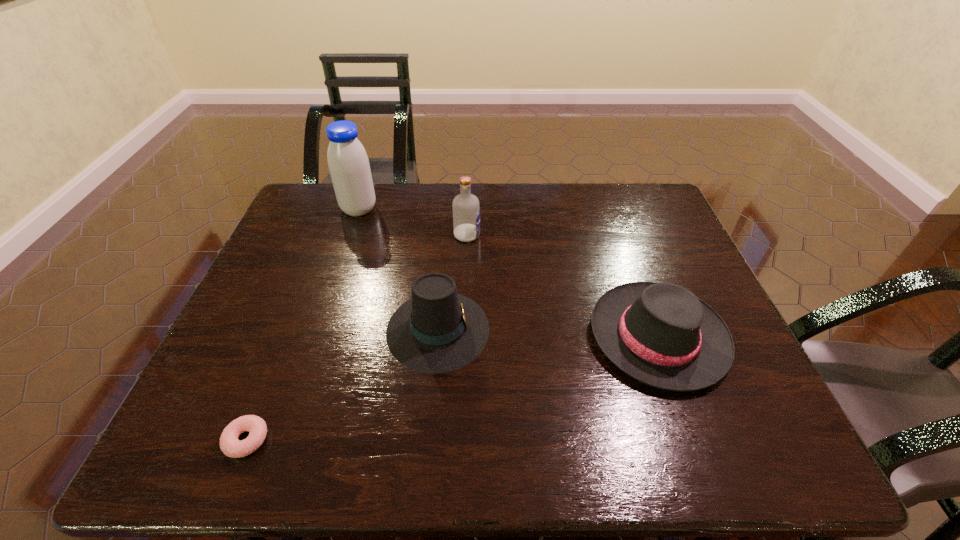
You are a GUI agent. You are given a task and a screenshot of the screen. Output one action in this format:
    pyautogui.click(x=<x>, y=<y>)
    Task: Click on the object at the far left corner
    The height and width of the screenshot is (540, 960).
    Given the screenshot: What is the action you would take?
    pyautogui.click(x=348, y=163)

The width and height of the screenshot is (960, 540). Find the location of `object at the near left corner`. object at the near left corner is located at coordinates (230, 445).

This screenshot has width=960, height=540. In the image, there is a desktop. What are the coordinates of `free space at the far edge` in the screenshot? It's located at (418, 215).

This screenshot has height=540, width=960. In the image, there is a desktop. Find the location of `vacant space at the near edge`. vacant space at the near edge is located at coordinates (605, 436).

The width and height of the screenshot is (960, 540). Identify the location of blank space at the left edge of the desktop. (283, 245).

Find the location of `free space at the right edge of the desktop`. free space at the right edge of the desktop is located at coordinates (678, 247).

At what (x,y) coordinates should I click in order to perform the action: click on vacant space at the far left corner. Please return your answer as a coordinate pair (x, y). This screenshot has width=960, height=540. Looking at the image, I should click on (308, 214).

Find the location of a particular element. The width and height of the screenshot is (960, 540). free space at the near left corner is located at coordinates (196, 423).

Locate an element on the screen. The height and width of the screenshot is (540, 960). free space between the left dress hat and the rightmost object is located at coordinates (548, 333).

At what (x,y) coordinates should I click in order to perform the action: click on vacant space that's between the nearest object and the taller dress hat. Please return your answer as a coordinate pair (x, y). Looking at the image, I should click on (343, 384).